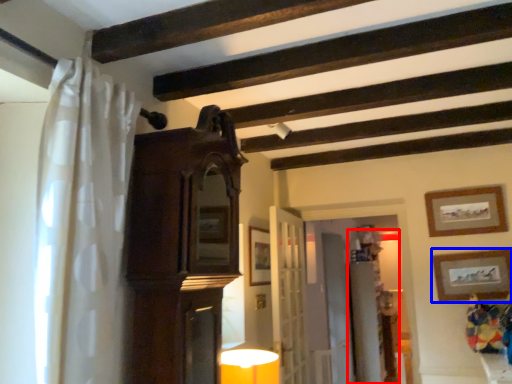
Question: Which of the following is the closest to the observer, dresser (highlighted by a red box) or picture frame (highlighted by a blue box)?

Choices:
 (A) dresser
 (B) picture frame

Answer: (B)